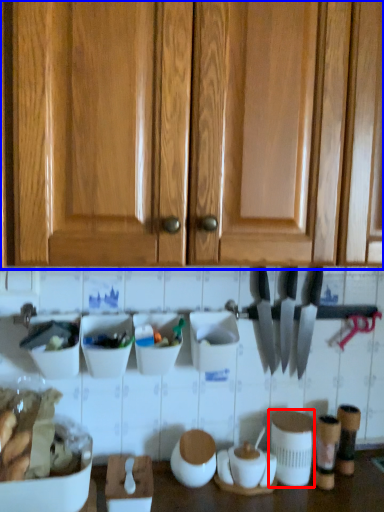
Question: Which object is closer to the camera taking this photo, appliance (highlighted by a red box) or cabinetry (highlighted by a blue box)?

Choices:
 (A) appliance
 (B) cabinetry

Answer: (B)